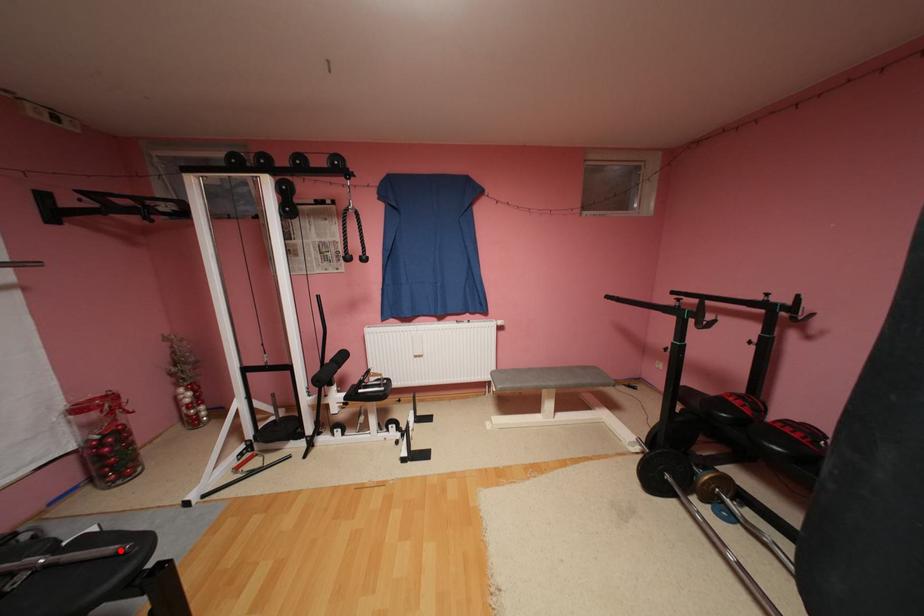
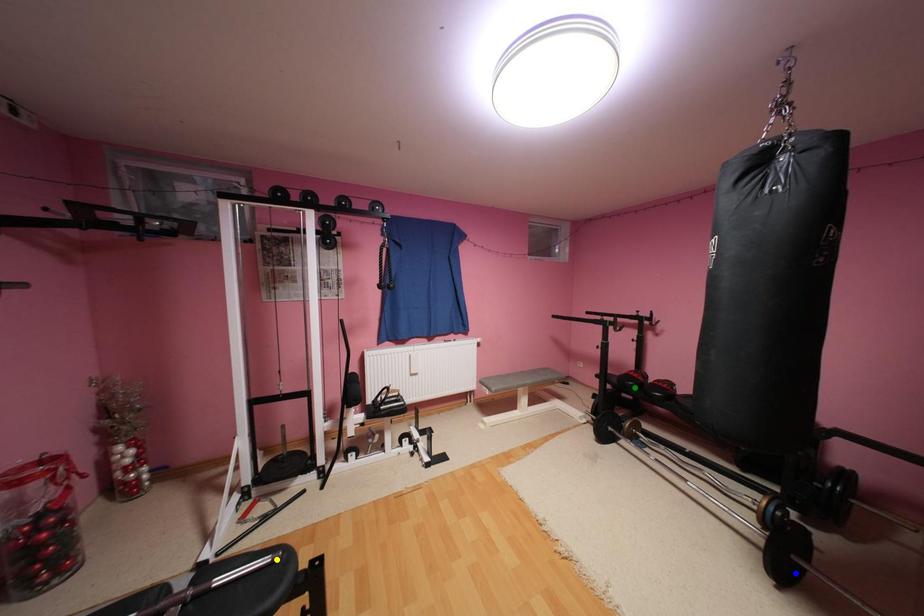
Question: I am providing you with two images of the same scene from different viewpoints. A red point is marked on the first image. You are given multiple points on the second image. Which point in image 2 represents the same 3d spot as the red point in image 1?

Choices:
 (A) green point
 (B) blue point
 (C) yellow point

Answer: (C)